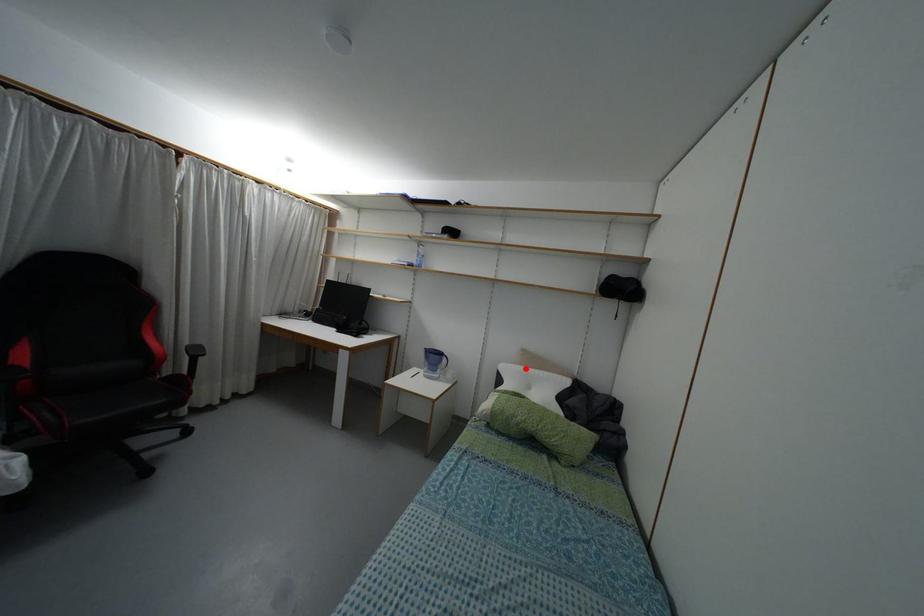
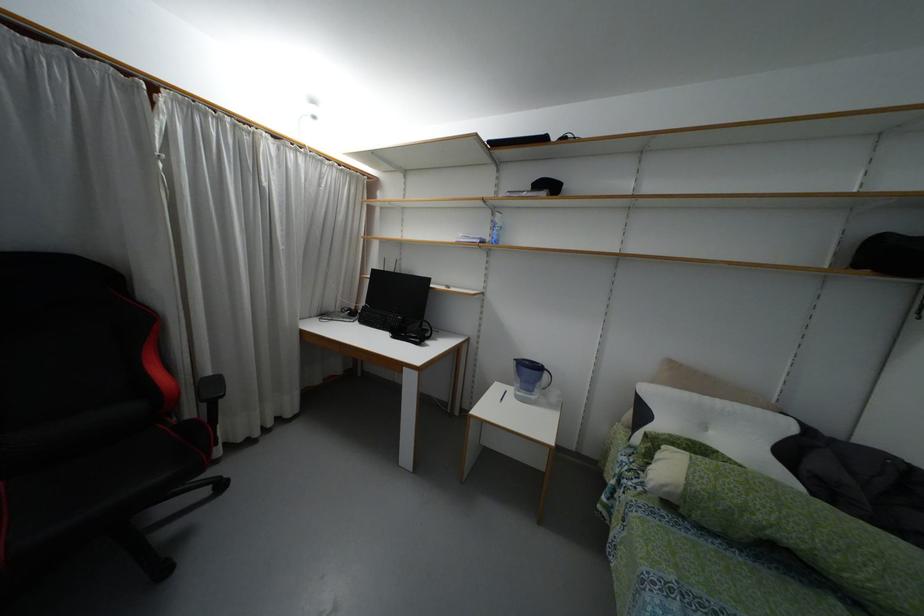
The point at the highlighted location is marked in the first image. Where is the corresponding point in the second image?

(695, 395)